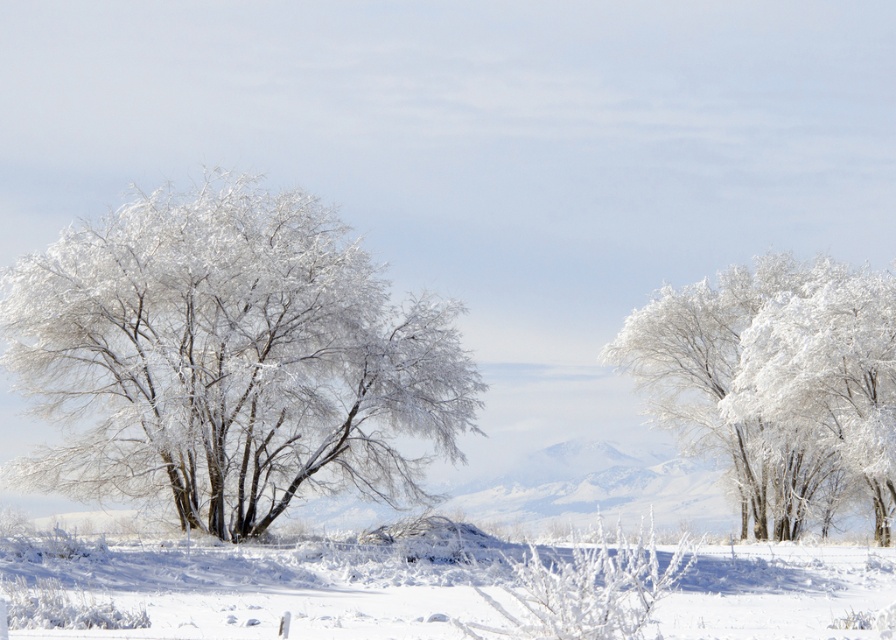
Is frosted white tree at left closer to camera compared to frosted white trees at center?

Yes, frosted white tree at left is closer to the viewer.

Is frosted white tree at left below frosted white trees at center?

Actually, frosted white tree at left is above frosted white trees at center.

Which is in front, point (139, 467) or point (840, 458)?

Point (139, 467)

You are a GUI agent. You are given a task and a screenshot of the screen. Output one action in this format:
    pyautogui.click(x=<x>, y=<y>)
    Task: Click on the frosted white tree at left
    The image size is (896, 640).
    Given the screenshot: What is the action you would take?
    pyautogui.click(x=228, y=358)